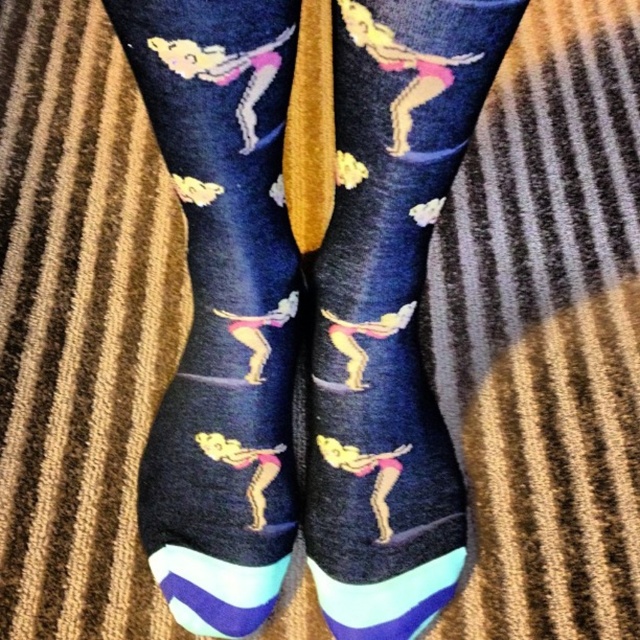
You are trying to decide between two pairs of socks displayed in a store window. The first pair is the matte dark blue socks with colorful gymnast design at center, and the second pair is the navy blue cotton socks at center. Based on their height, which pair would you choose if you want the shorter ones?

The matte dark blue socks with colorful gymnast design at center is not as tall as the navy blue cotton socks at center, so you should choose the matte dark blue socks with colorful gymnast design at center if you want the shorter ones.

You are trying to choose between two pairs of socks for a workout. The first pair is the matte dark blue socks with colorful gymnast design at center, and the second pair is the navy blue cotton socks at center. Based on their thickness, which pair might be more comfortable for a high intensity workout?

The navy blue cotton socks at center are thicker than the matte dark blue socks with colorful gymnast design at center, so they might be more comfortable for a high intensity workout.